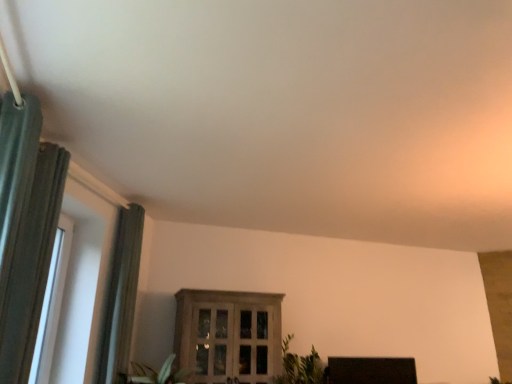
Question: From a real-world perspective, is green textured curtain at left, acting as the 2th curtain starting from the front, positioned above or below green leafy plant at lower center?

Choices:
 (A) below
 (B) above

Answer: (B)

Question: Choose the correct answer: Is green textured curtain at left, positioned as the first curtain in back-to-front order, inside green leafy plant at lower center or outside it?

Choices:
 (A) inside
 (B) outside

Answer: (B)

Question: Which object is the farthest from the wooden cabinet at center, placed as the 1th window when sorted from right to left?

Choices:
 (A) green leafy plant at lower center
 (B) green textured curtain at left, positioned as the first curtain in back-to-front order
 (C) green fabric curtain at left, positioned as the second curtain in back-to-front order
 (D) black matte tv at lower right
 (E) white plastic window at left, the second window viewed from the back

Answer: (C)

Question: Considering the real-world distances, which object is closest to the green textured curtain at left, positioned as the first curtain in back-to-front order?

Choices:
 (A) green fabric curtain at left, positioned as the second curtain in back-to-front order
 (B) green leafy plant at lower center
 (C) white plastic window at left, which ranks as the first window in left-to-right order
 (D) black matte tv at lower right
 (E) wooden cabinet at center, which appears as the first window when viewed from the back

Answer: (C)